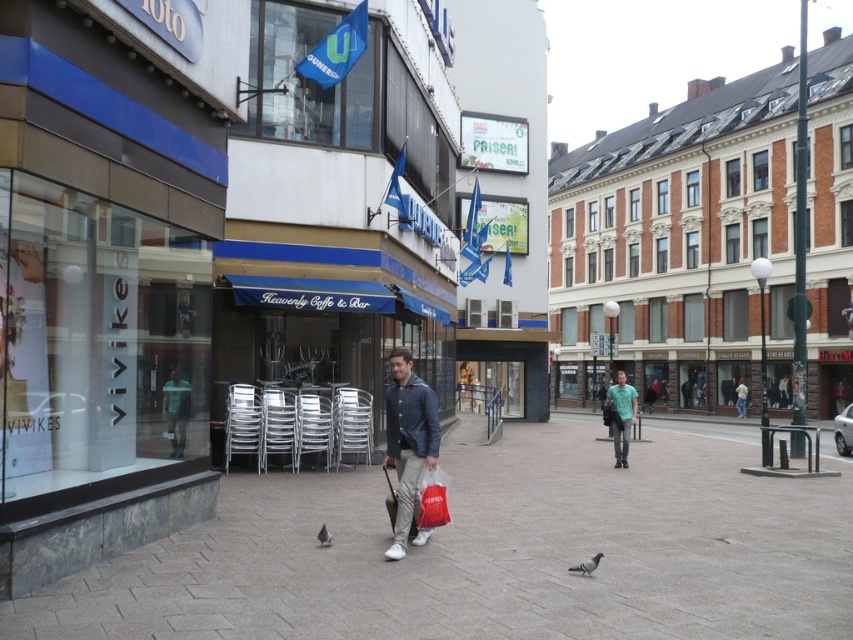
Question: Estimate the real-world distances between objects in this image. Which object is farther from the denim jacket at center?

Choices:
 (A) gray matte pigeon at center
 (B) green cotton t-shirt at center
 (C) red plastic bag at center
 (D) brown brick building at center

Answer: (D)

Question: Which object is positioned farthest from the gray feathered pigeon at center?

Choices:
 (A) denim jacket at center
 (B) red plastic bag at center
 (C) smooth concrete pavement at center
 (D) brown brick building at center

Answer: (D)

Question: Is smooth concrete pavement at center wider than red plastic bag at center?

Choices:
 (A) yes
 (B) no

Answer: (A)

Question: Which object is positioned closest to the green cotton t-shirt at center?

Choices:
 (A) light gray jacket at center
 (B) smooth concrete pavement at center

Answer: (B)

Question: Does red plastic bag at center appear under gray matte pigeon at center?

Choices:
 (A) yes
 (B) no

Answer: (B)

Question: Can you confirm if green cotton t-shirt at center is bigger than red plastic bag at center?

Choices:
 (A) no
 (B) yes

Answer: (B)